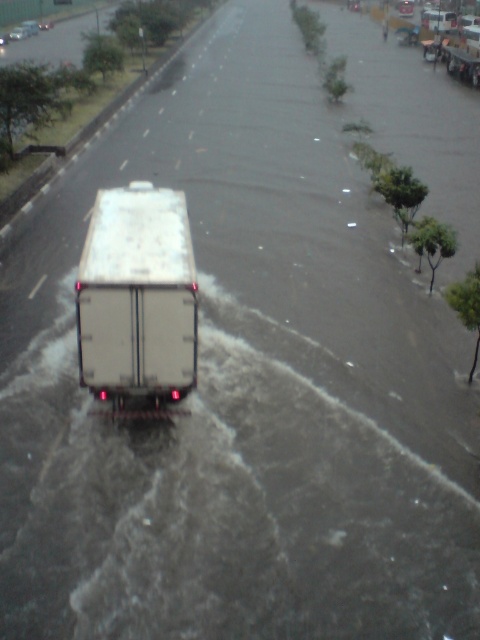
Locate an element on the screen. The width and height of the screenshot is (480, 640). white matte trailer truck at center is located at coordinates (137, 298).

In the scene shown: Who is shorter, white matte trailer truck at center or white matte truck at center?

white matte trailer truck at center

The image size is (480, 640). What do you see at coordinates (137, 298) in the screenshot?
I see `white matte trailer truck at center` at bounding box center [137, 298].

Locate an element on the screen. The width and height of the screenshot is (480, 640). white matte trailer truck at center is located at coordinates (137, 298).